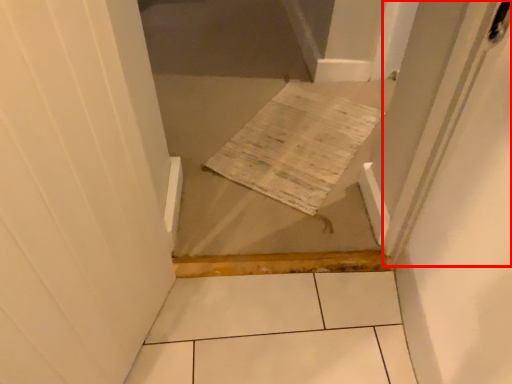
Question: From the image's perspective, what is the correct spatial relationship of screen door (annotated by the red box) in relation to cardboard?

Choices:
 (A) above
 (B) below

Answer: (A)